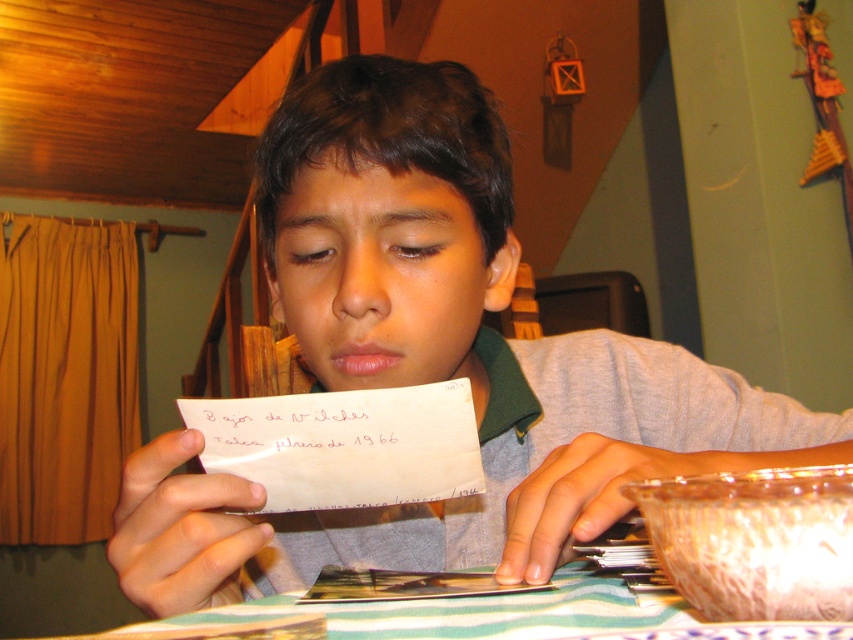
Question: Is white paper at center wider than black paper at center?

Choices:
 (A) yes
 (B) no

Answer: (A)

Question: Which point is closer to the camera?

Choices:
 (A) (343, 408)
 (B) (230, 456)

Answer: (A)

Question: Among these points, which one is nearest to the camera?

Choices:
 (A) (253, 444)
 (B) (222, 429)

Answer: (B)

Question: Which point is farther to the camera?

Choices:
 (A) white paper at center
 (B) black paper at center

Answer: (B)

Question: Can you confirm if white paper at center is positioned below black paper at center?

Choices:
 (A) no
 (B) yes

Answer: (B)

Question: Does white paper at center appear over black paper at center?

Choices:
 (A) no
 (B) yes

Answer: (A)